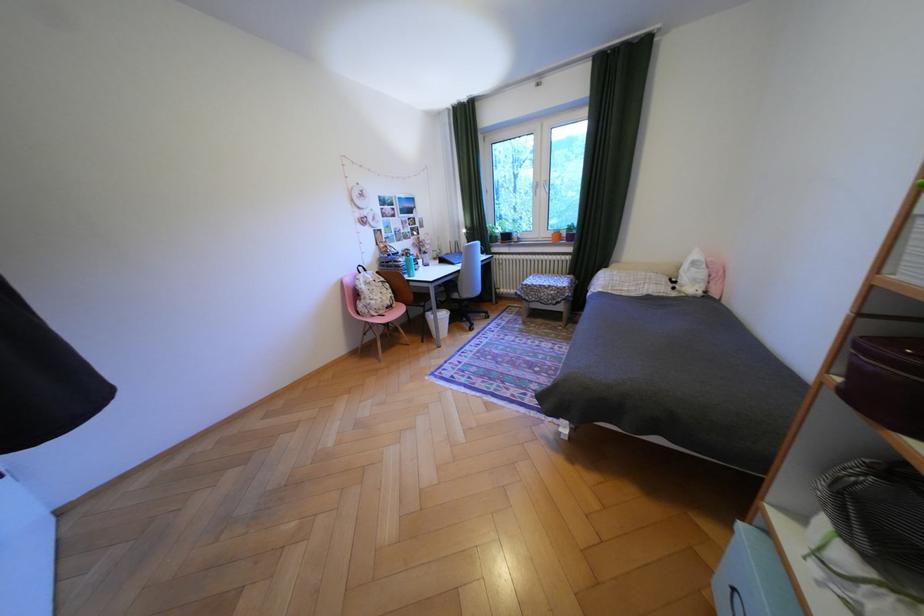
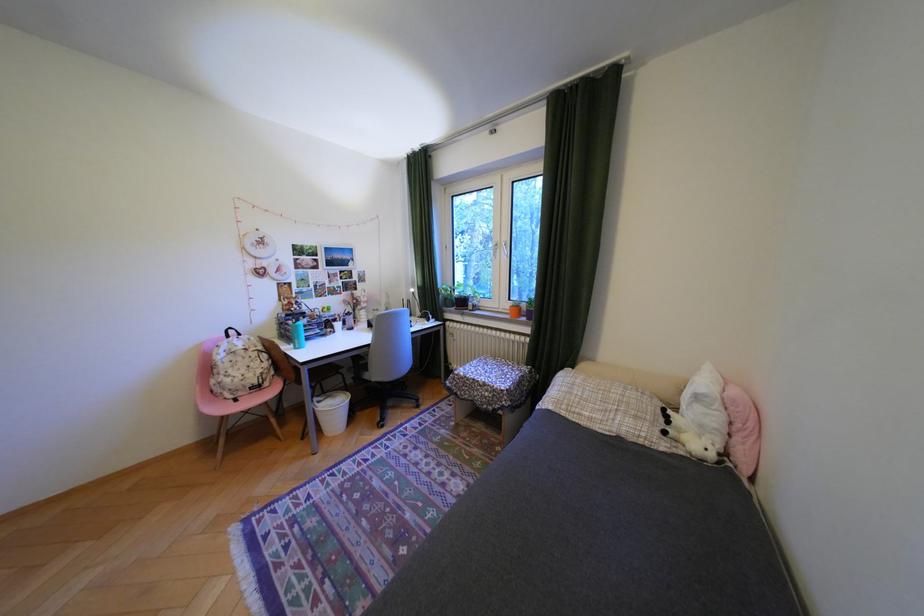
In the second image, find the point that corresponds to (393,312) in the first image.

(251, 394)